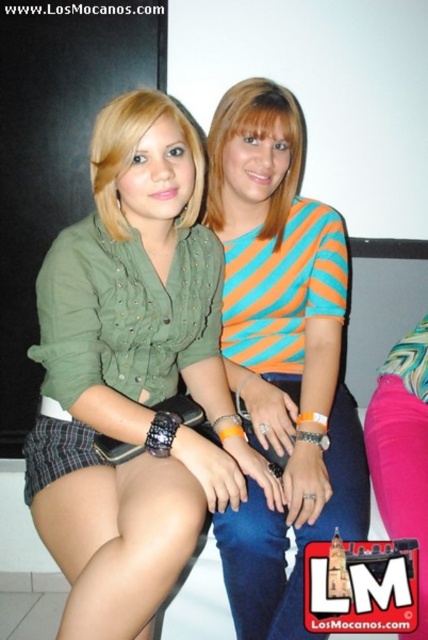
Is point (180, 176) less distant than point (228, 125)?

Yes.

Image resolution: width=428 pixels, height=640 pixels. I want to click on green fabric shirt at center, so click(133, 376).